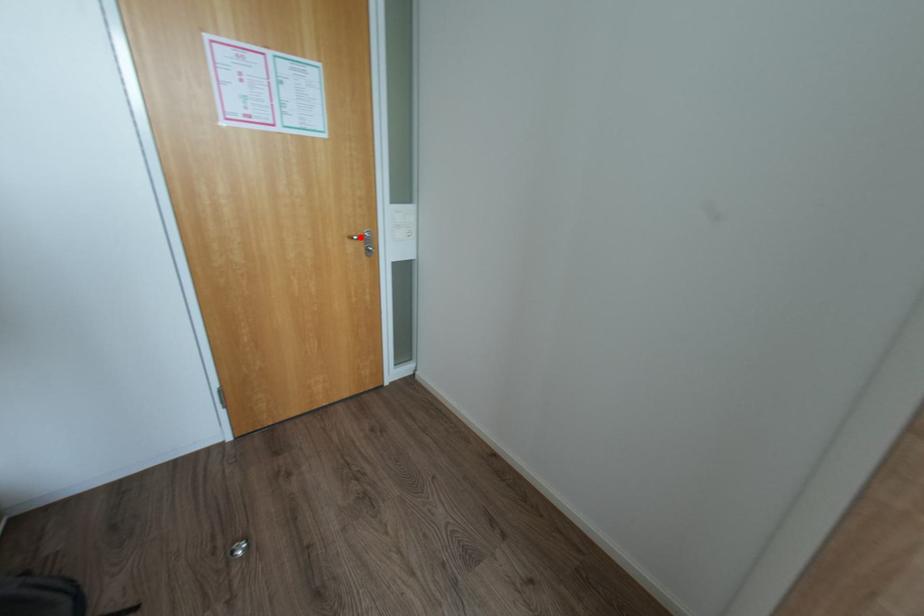
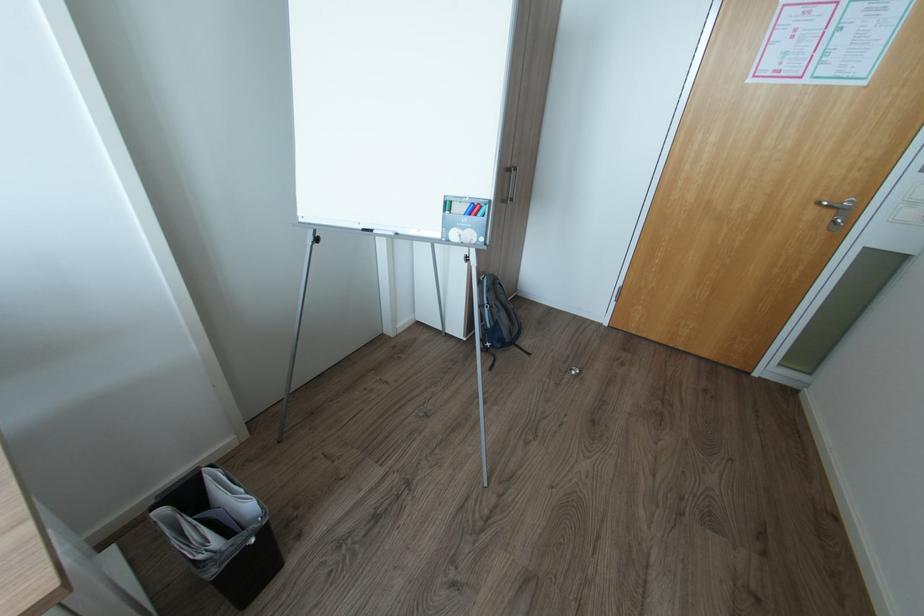
Question: I am providing you with two images of the same scene from different viewpoints. A red point is marked on the first image. Is the red point's position out of view in image 2?

Choices:
 (A) Yes
 (B) No

Answer: (B)